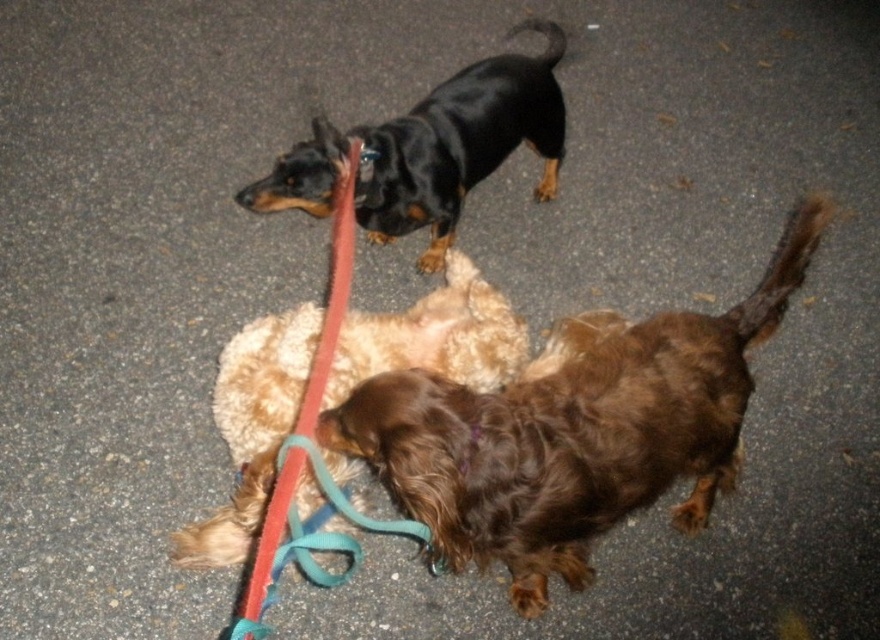
Which is in front, point (485, 536) or point (279, 346)?

Point (485, 536)

Who is positioned more to the left, brown shaggy dog at center or fuzzy brown dog at center?

Positioned to the left is fuzzy brown dog at center.

Between point (607, 461) and point (290, 356), which one is positioned behind?

The point (290, 356) is more distant.

Find the location of a particular element. brown shaggy dog at center is located at coordinates tap(574, 433).

Can you confirm if brown shaggy dog at center is wider than black glossy dog at upper center?

Correct, the width of brown shaggy dog at center exceeds that of black glossy dog at upper center.

Locate an element on the screen. brown shaggy dog at center is located at coordinates [574, 433].

Who is higher up, fuzzy brown dog at center or black glossy dog at upper center?

Positioned higher is black glossy dog at upper center.

How far apart are fuzzy brown dog at center and black glossy dog at upper center?

They are 19.94 inches apart.

Is point (264, 340) positioned after point (541, 58)?

No, it is in front of (541, 58).

This screenshot has height=640, width=880. I want to click on fuzzy brown dog at center, so click(251, 428).